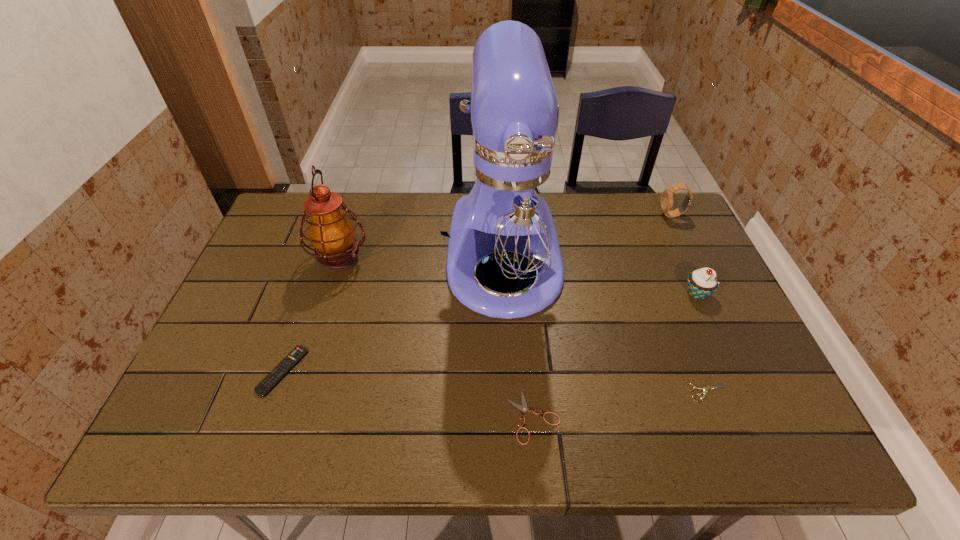
Find the location of a particular element. mixer is located at coordinates (509, 213).

Locate an element on the screen. the second tallest object is located at coordinates coord(331,232).

The width and height of the screenshot is (960, 540). In order to click on watch in this screenshot , I will do `click(667, 196)`.

The image size is (960, 540). Identify the location of cupcake. (701, 283).

Find the location of a particular element. Image resolution: width=960 pixels, height=540 pixels. the third shortest object is located at coordinates (298, 353).

Find the location of `the left shears`. the left shears is located at coordinates (523, 408).

Identify the location of the right shears. This screenshot has width=960, height=540. (706, 388).

Image resolution: width=960 pixels, height=540 pixels. I want to click on free space located 0.240m at the mixing area of the mixer, so click(514, 424).

Identify the location of vacant space located 0.120m on the front of the oil lamp. This screenshot has height=540, width=960. (323, 315).

Where is `free space located 0.170m on the face of the watch`? The width and height of the screenshot is (960, 540). free space located 0.170m on the face of the watch is located at coordinates (609, 215).